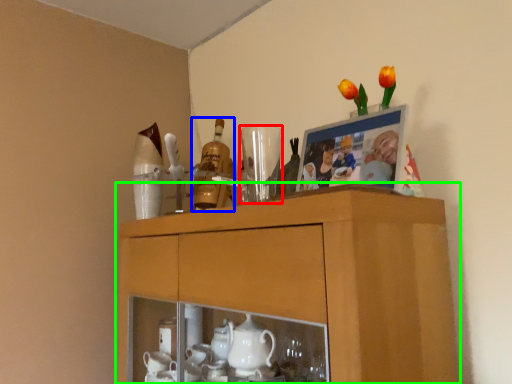
Question: Considering the real-world distances, which object is farthest from tableware (highlighted by a red box)? bottle (highlighted by a blue box) or cabinetry (highlighted by a green box)?

Choices:
 (A) bottle
 (B) cabinetry

Answer: (B)